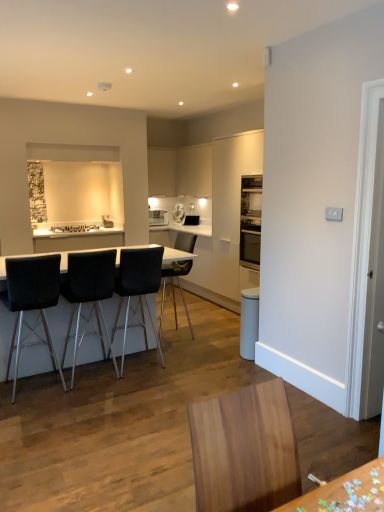
Question: From the image's perspective, is white glossy cabinet at upper center, placed as the 2th cabinetry when sorted from left to right, located above black fabric chair at left, which is the first chair from left to right?

Choices:
 (A) yes
 (B) no

Answer: (A)

Question: Considering the relative positions of white glossy cabinet at upper center, which is the first cabinetry in right-to-left order, and black fabric chair at left, the fourth chair in the right-to-left sequence, in the image provided, is white glossy cabinet at upper center, which is the first cabinetry in right-to-left order, to the right of black fabric chair at left, the fourth chair in the right-to-left sequence, from the viewer's perspective?

Choices:
 (A) yes
 (B) no

Answer: (A)

Question: Is white glossy cabinet at upper center, placed as the 2th cabinetry when sorted from left to right, bigger than black fabric chair at left, the fourth chair in the right-to-left sequence?

Choices:
 (A) yes
 (B) no

Answer: (A)

Question: Is white glossy cabinet at upper center, which is the first cabinetry in right-to-left order, not near black fabric chair at left, the fourth chair in the right-to-left sequence?

Choices:
 (A) no
 (B) yes

Answer: (B)

Question: Is white glossy cabinet at upper center, placed as the 2th cabinetry when sorted from left to right, behind black fabric chair at left, the fourth chair in the right-to-left sequence?

Choices:
 (A) yes
 (B) no

Answer: (A)

Question: Visually, is white glossy coffee machine at center positioned to the left or to the right of white glossy table at center?

Choices:
 (A) right
 (B) left

Answer: (A)

Question: Looking at their shapes, would you say white glossy coffee machine at center is wider or thinner than white glossy table at center?

Choices:
 (A) wide
 (B) thin

Answer: (B)

Question: From the image's perspective, relative to white glossy table at center, is white glossy coffee machine at center above or below?

Choices:
 (A) below
 (B) above

Answer: (B)

Question: Based on their sizes in the image, would you say white glossy coffee machine at center is bigger or smaller than white glossy table at center?

Choices:
 (A) big
 (B) small

Answer: (B)

Question: Is white glossy table at center in front of or behind black leather chair at center, which is counted as the third chair, starting from the right, in the image?

Choices:
 (A) behind
 (B) front

Answer: (B)

Question: From the image's perspective, is white glossy table at center located above or below black leather chair at center, acting as the 2th chair starting from the left?

Choices:
 (A) below
 (B) above

Answer: (A)

Question: Is point (82, 355) closer or farther from the camera than point (87, 289)?

Choices:
 (A) farther
 (B) closer

Answer: (A)

Question: From a real-world perspective, is white glossy table at center positioned above or below black leather chair at center, which is counted as the third chair, starting from the right?

Choices:
 (A) above
 (B) below

Answer: (B)

Question: Relative to black fabric chair at left, which is the first chair from left to right, is white glossy cabinet at upper center, placed as the 2th cabinetry when sorted from left to right, in front or behind?

Choices:
 (A) front
 (B) behind

Answer: (B)

Question: Is white glossy cabinet at upper center, placed as the 2th cabinetry when sorted from left to right, situated inside black fabric chair at left, the fourth chair in the right-to-left sequence, or outside?

Choices:
 (A) inside
 (B) outside

Answer: (B)